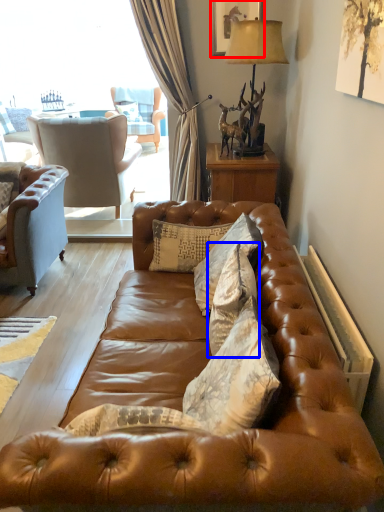
Question: Among these objects, which one is farthest to the camera, picture frame (highlighted by a red box) or pillow (highlighted by a blue box)?

Choices:
 (A) picture frame
 (B) pillow

Answer: (A)